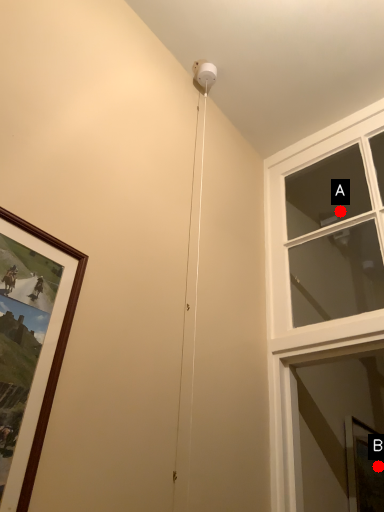
Question: Two points are circled on the image, labeled by A and B beside each circle. Among these points, which one is farthest from the camera?

Choices:
 (A) A is further
 (B) B is further

Answer: (A)